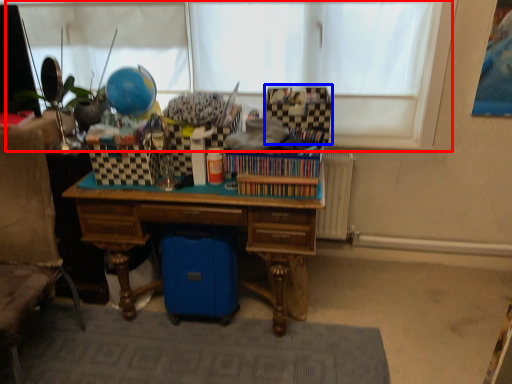
Question: Among these objects, which one is nearest to the camera, window screen (highlighted by a red box) or storage box (highlighted by a blue box)?

Choices:
 (A) window screen
 (B) storage box

Answer: (B)